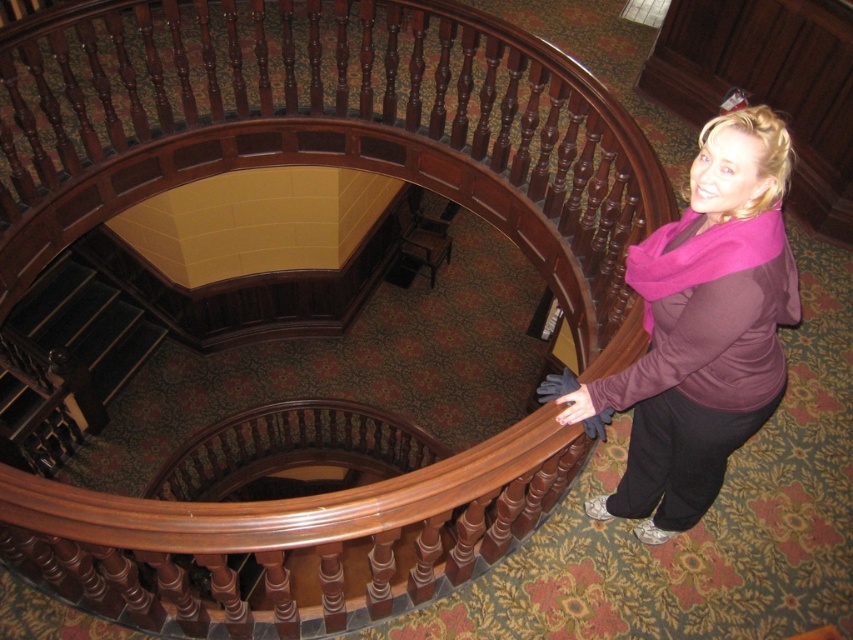
You are standing at the top of the spiral staircase and see the matte pink scarf at lower right and the dark wood stairs at lower left. Which object is shorter in height?

The matte pink scarf at lower right is shorter in height than the dark wood stairs at lower left because it is not as tall as them.

You are standing at the top of the spiral staircase and notice a matte pink scarf at lower right and dark wood stairs at lower left. Which object is narrower in width?

The matte pink scarf at lower right is thinner than the dark wood stairs at lower left, so the matte pink scarf at lower right is narrower in width.